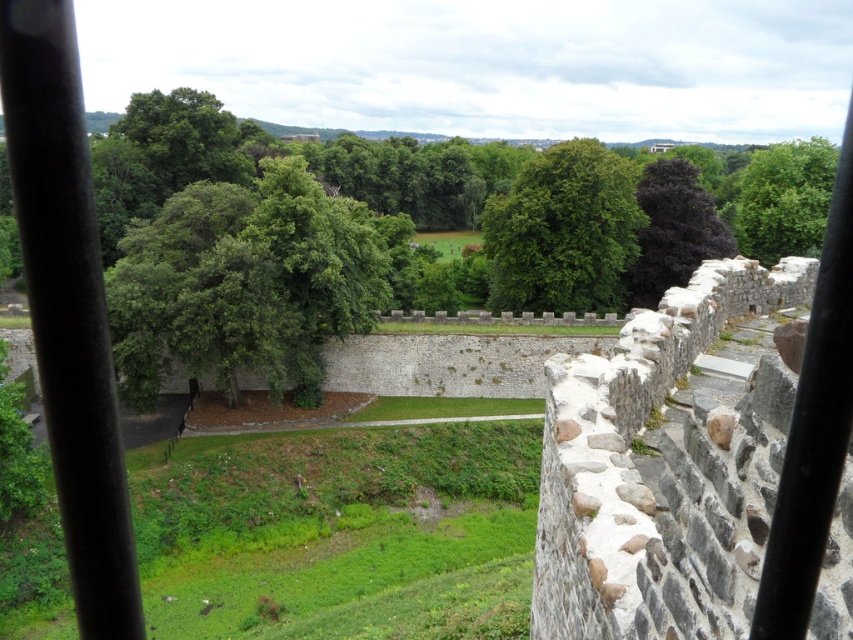
You are standing on the top of the stone wall and want to move from the point at coordinates point (566, 282) to the point at coordinates point (782, 150). Which direction should you move relative to your current position?

You should move backward because point (566, 282) is in front of point (782, 150), meaning the destination is behind your current position.

You are standing on the stone wall and looking out. Which tree, the green leafy tree at center or the dark purple leafy tree at upper right, is positioned higher in your field of view?

The green leafy tree at center is positioned higher in your field of view because it is located above the dark purple leafy tree at upper right.